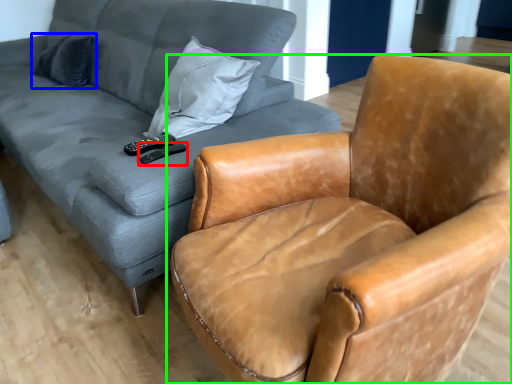
Question: Based on their relative distances, which object is farther from remote (highlighted by a red box)? Choose from pillow (highlighted by a blue box) and chair (highlighted by a green box).

Choices:
 (A) pillow
 (B) chair

Answer: (A)